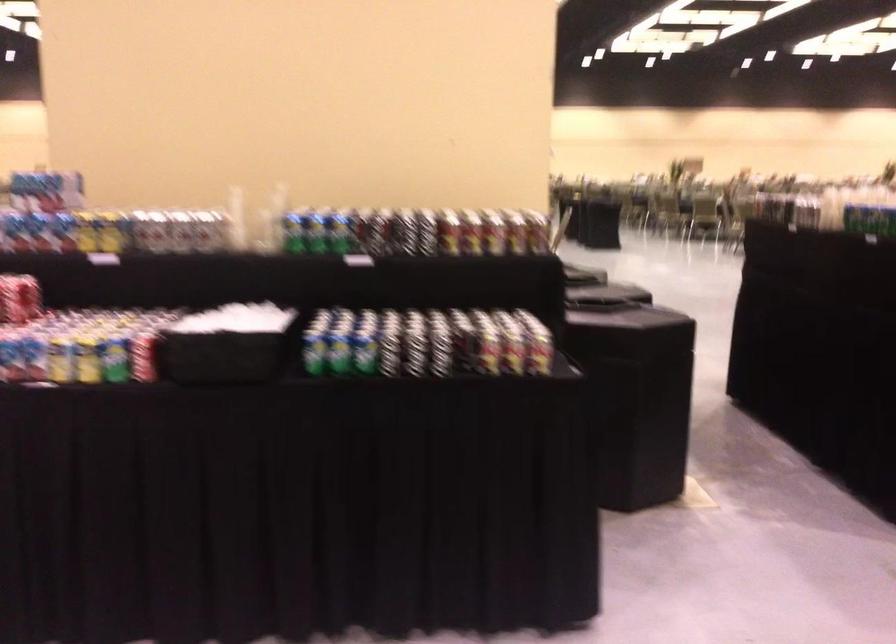
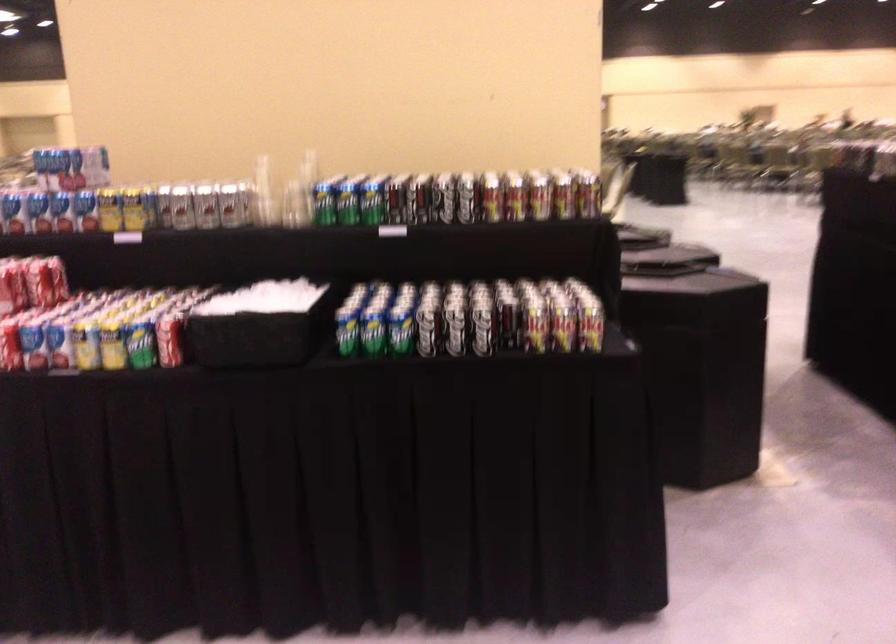
Question: The camera is either moving clockwise (left) or counter-clockwise (right) around the object. The first image is from the beginning of the video and the second image is from the end. Is the camera moving left or right when shooting the video?

Choices:
 (A) Left
 (B) Right

Answer: (B)